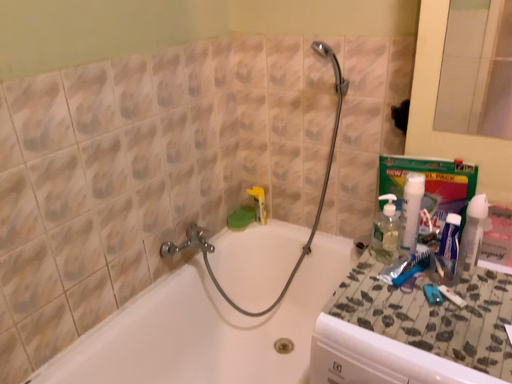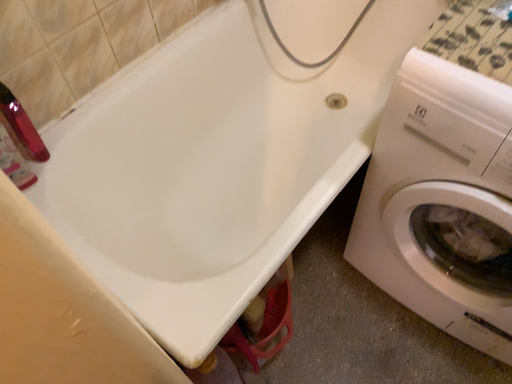
Question: How did the camera likely rotate when shooting the video?

Choices:
 (A) rotated downward
 (B) rotated upward

Answer: (A)